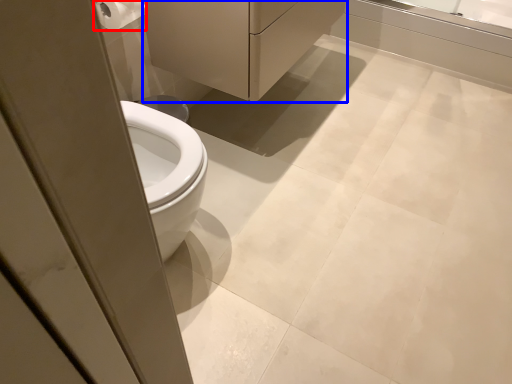
Question: Which object is further to the camera taking this photo, toilet paper (highlighted by a red box) or porcelain (highlighted by a blue box)?

Choices:
 (A) toilet paper
 (B) porcelain

Answer: (B)